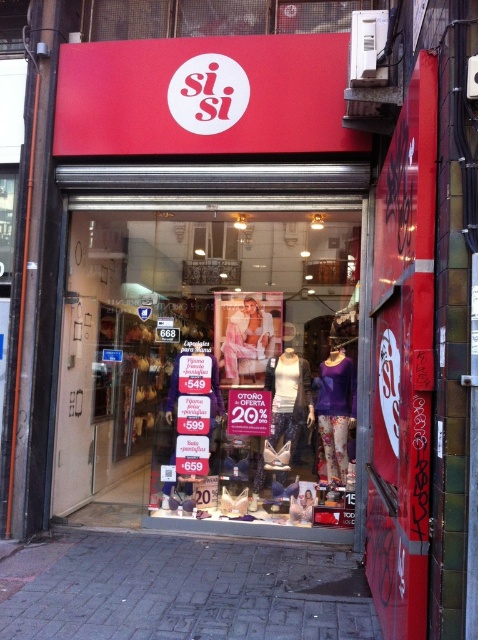
From the picture: You are a delivery person trying to deliver a package to the Sisi store. You need to place the package on the counter inside the store. To do this, you must determine which object between the transparent glass at center and the purple matte sweater at center is larger so you can avoid it. Which object should you avoid?

The transparent glass at center is bigger than the purple matte sweater at center, so you should avoid the transparent glass at center to place the package safely on the counter inside the store.

You are standing outside the Sisi store and want to touch the glass window at the center. Can you reach the point at coordinate point (209, 356) on the glass window?

The point (209, 356) is on transparent glass at center, so yes, you can reach the point at coordinate point (209, 356) on the glass window since it is on the transparent glass at center.

You are a delivery person trying to deliver a package to the Sisi store. You need to place the package on the counter inside the store. Since you can see both the transparent glass at center and the purple matte sweater at center through the storefront, which object should you aim for to ensure the package reaches the correct location?

The transparent glass at center is wider than the purple matte sweater at center, so you should aim for the transparent glass at center to place the package on the counter inside the store.